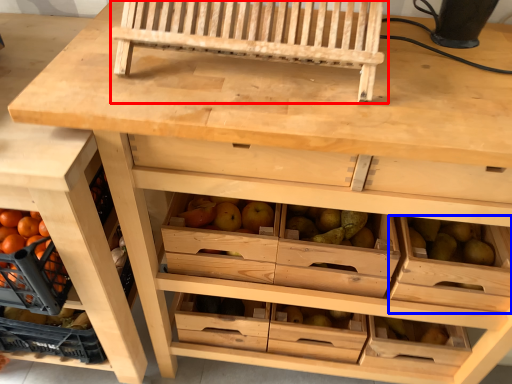
Question: Which of the following is the closest to the observer, church bench (highlighted by a red box) or drawer (highlighted by a blue box)?

Choices:
 (A) church bench
 (B) drawer

Answer: (A)